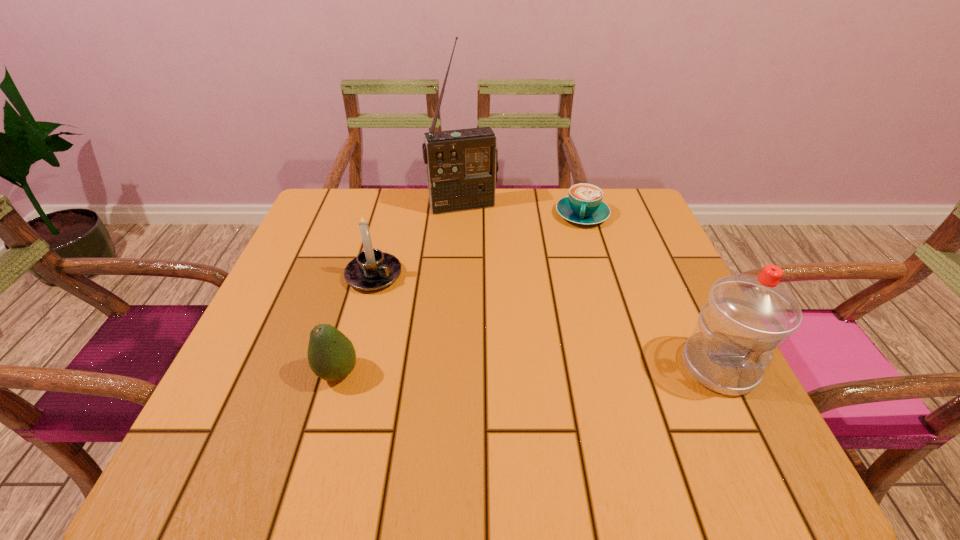
The height and width of the screenshot is (540, 960). I want to click on vacant space on the desktop that is between the avocado and the water bottle and is positioned with a handle on the side of the candle holder, so click(531, 370).

At what (x,y) coordinates should I click in order to perform the action: click on free space on the desktop that is between the fourth tallest object and the water bottle and is positioned with the handle on the right side of the cappuccino. Please return your answer as a coordinate pair (x, y). Looking at the image, I should click on (553, 369).

What are the coordinates of `free space on the desktop that is between the avocado and the water bottle and is positioned on the display of the third object from right to left` in the screenshot? It's located at (524, 370).